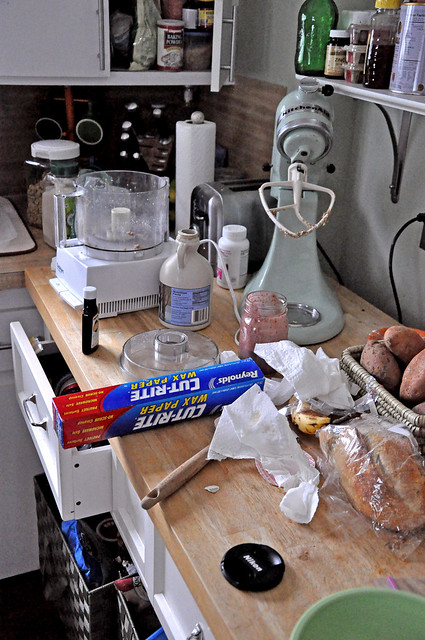
Where is `open cupboard`? The image size is (425, 640). open cupboard is located at coordinates (210, 43).